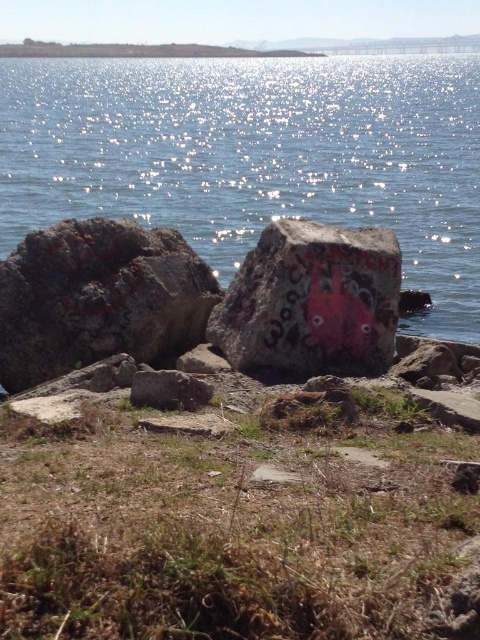
Which is behind, point (385, 362) or point (170, 388)?

The point (385, 362) is more distant.

Does point (357, 356) lie in front of point (180, 376)?

No, it is behind (180, 376).

Does point (321, 365) come in front of point (159, 376)?

No, it is behind (159, 376).

The height and width of the screenshot is (640, 480). I want to click on smooth concrete boulder at center, so click(x=312, y=301).

Is glistening water at center behind smooth concrete boulder at center?

That is True.

Based on the photo, does glistening water at center have a lesser height compared to smooth concrete boulder at center?

No.

Where is `glistening water at center`? This screenshot has height=640, width=480. glistening water at center is located at coordinates (256, 156).

Identify the location of glistening water at center. (256, 156).

Is rusty rock at left positioned in front of smooth gray rock at center?

That is False.

The image size is (480, 640). Identify the location of rusty rock at left. (98, 298).

Where is `rusty rock at left`? This screenshot has width=480, height=640. rusty rock at left is located at coordinates (98, 298).